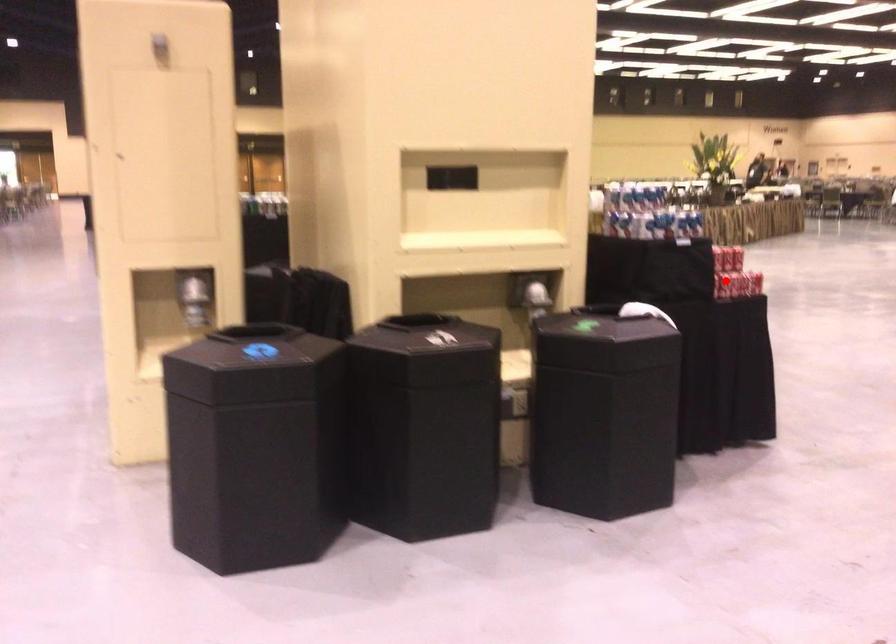
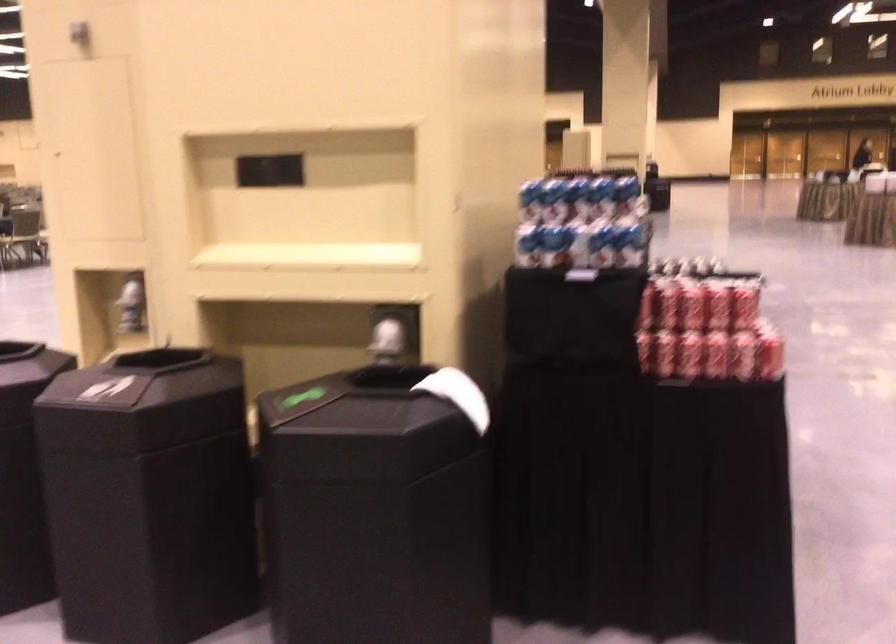
Locate, in the second image, the point that corresponds to the highlighted location in the first image.

(645, 351)